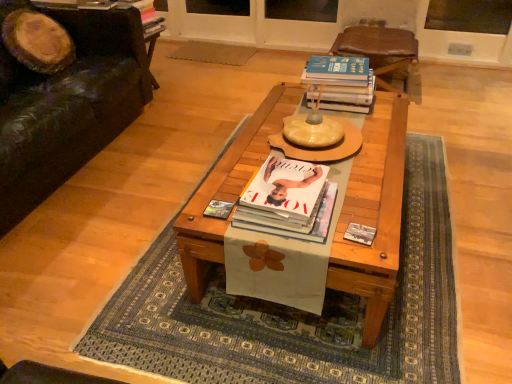
Identify the location of free space that is to the left of white paper with flower design at center. (109, 208).